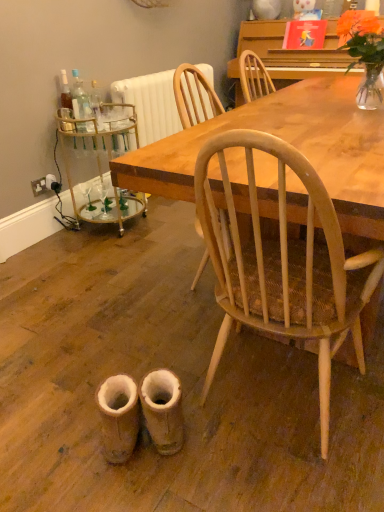
Question: In the image, is wooden table at center positioned in front of or behind orange matte vase at upper right?

Choices:
 (A) behind
 (B) front

Answer: (B)

Question: Is wooden table at center situated inside orange matte vase at upper right or outside?

Choices:
 (A) inside
 (B) outside

Answer: (B)

Question: Which object is the farthest from the orange matte flower at upper right?

Choices:
 (A) leather boot at lower center, which is counted as the second walking shoe, starting from the left
 (B) leather boot at lower left, acting as the second walking shoe starting from the right
 (C) wooden table at center
 (D) clear glass bottle at left
 (E) orange matte vase at upper right

Answer: (B)

Question: Which of these objects is positioned farthest from the gold mirrored bar cart at left?

Choices:
 (A) leather boot at lower center, which is counted as the second walking shoe, starting from the left
 (B) orange matte flower at upper right
 (C) wooden table at center
 (D) orange matte vase at upper right
 (E) clear glass bottle at left

Answer: (D)